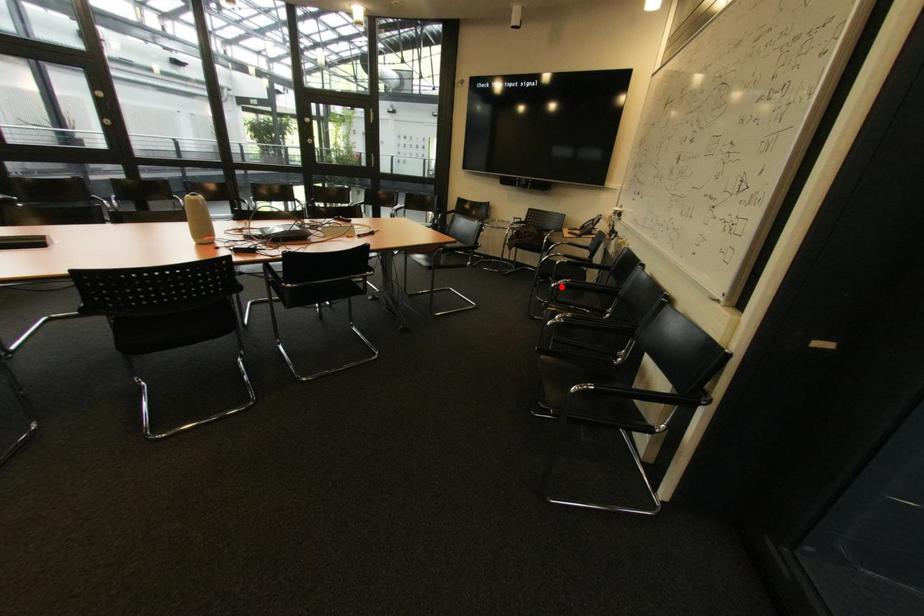
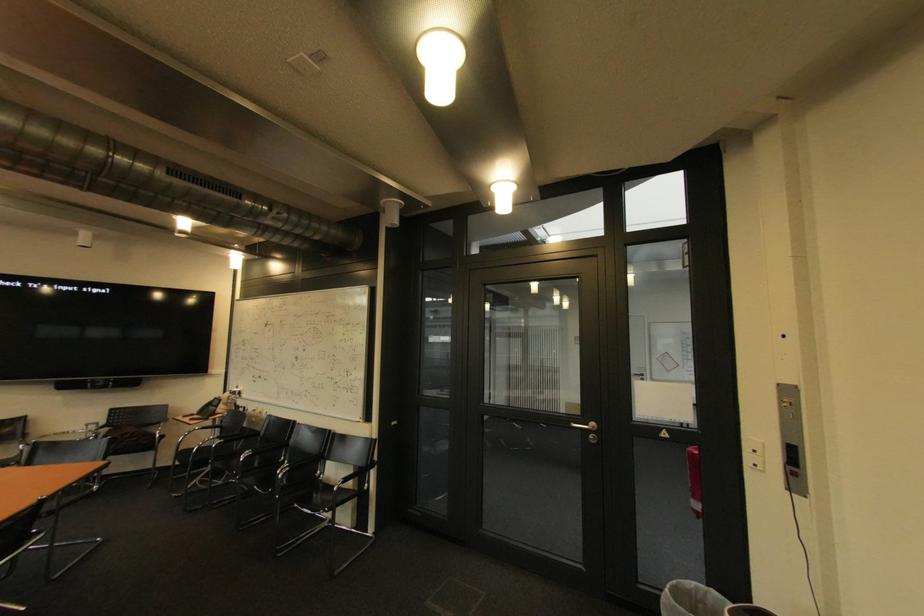
Question: I am providing you with two images of the same scene from different viewpoints. Image1 has a red point marked. In image2, the corresponding 3D location appears at what relative position? Reply with the corresponding letter.

Choices:
 (A) Closer
 (B) Farther

Answer: (B)